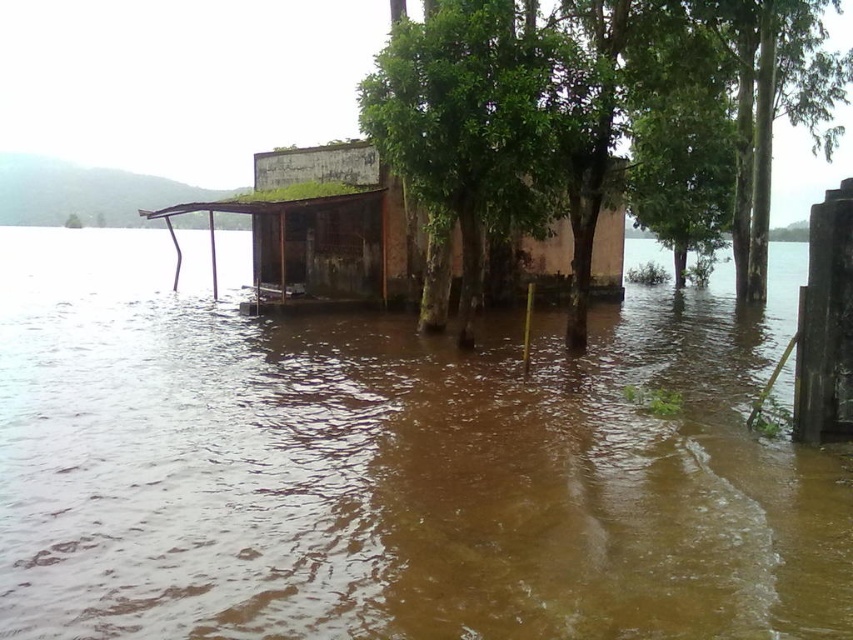
Based on the scene of a flooded area with a submerged structure, you need to determine if the brown muddy water at center can completely surround the green leafy tree at center. Can you confirm this?

The brown muddy water at center might be wider than green leafy tree at center, so there is a possibility that the water could surround the tree, but it is not certain.

You are navigating a small boat through the flooded area shown in the image. You need to reach a safe point located at point (393, 236). There is an obstacle at point (624, 506). Which point should you avoid to reach your destination safely?

You should avoid point (624, 506) because it is in front of point (393, 236), meaning the obstacle is blocking the path to your destination.

Consider the image. You are a rescue worker trying to navigate through the flooded area. There is a point marked at coordinates (x=392, y=468) which is brown muddy water at center. Can you safely walk on that point?

The point at coordinates (x=392, y=468) is brown muddy water at center, so it is not safe to walk there as it is submerged in water.